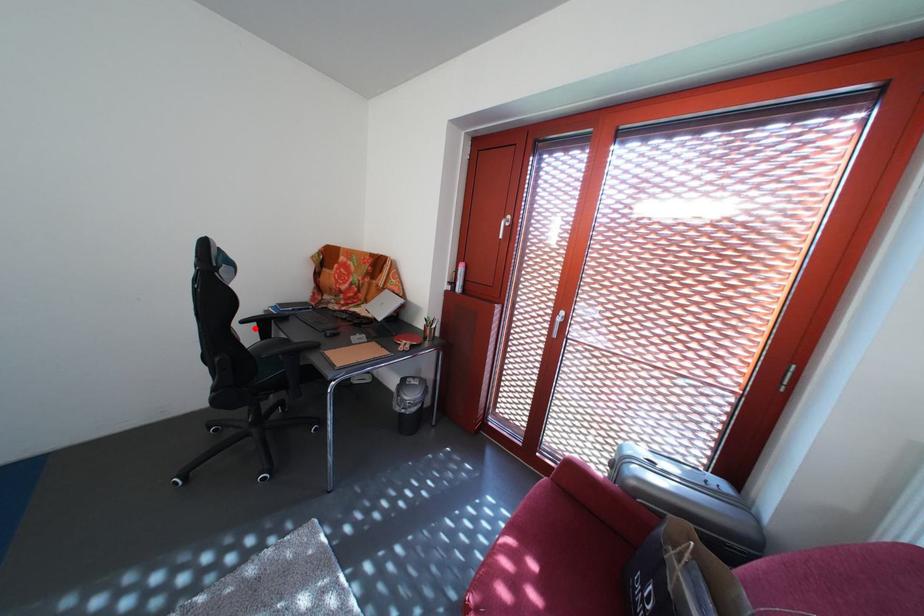
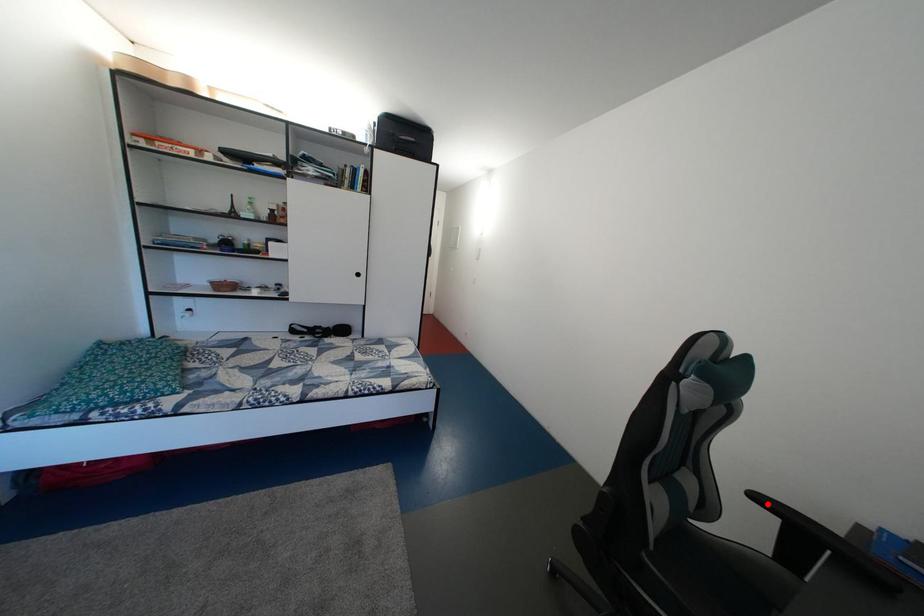
I am providing you with two images of the same scene from different viewpoints. A red point is marked on the first image and another point is marked on the second image. Do the highlighted points in image1 and image2 indicate the same real-world spot?

Yes